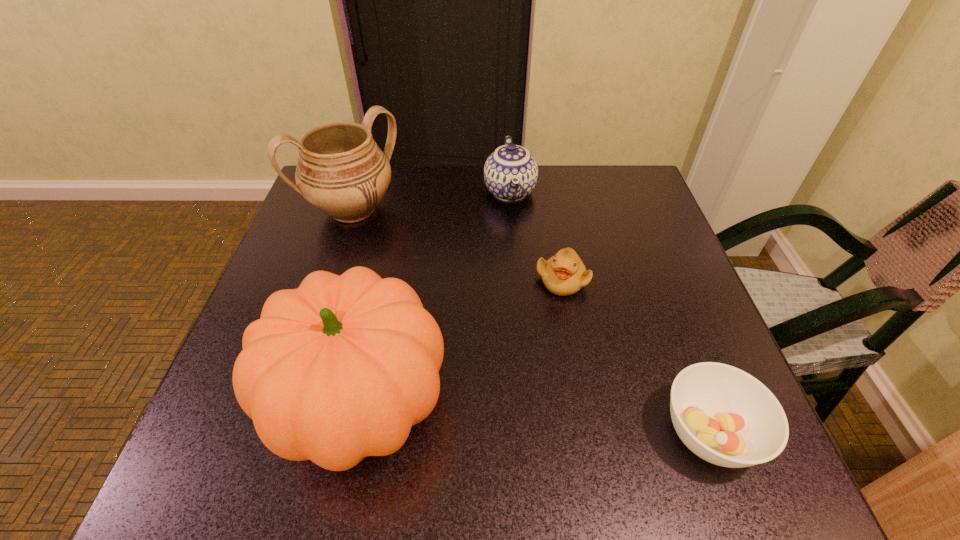
This screenshot has height=540, width=960. I want to click on free location located at the spout of the third shortest object, so click(x=517, y=246).

Where is `vacant region located at the spout of the third shortest object`? This screenshot has width=960, height=540. vacant region located at the spout of the third shortest object is located at coordinates [x=523, y=286].

The image size is (960, 540). What are the coordinates of `vacant area located 0.210m at the spout of the third shortest object` in the screenshot? It's located at (522, 280).

The width and height of the screenshot is (960, 540). Identify the location of free point located on the front-facing side of the urn. (444, 309).

The height and width of the screenshot is (540, 960). I want to click on vacant area situated 0.360m on the front-facing side of the urn, so click(x=462, y=328).

This screenshot has width=960, height=540. I want to click on vacant space situated 0.390m on the front-facing side of the urn, so click(x=470, y=338).

Identify the location of chinaware present at the far edge. The image size is (960, 540). (510, 173).

The height and width of the screenshot is (540, 960). Find the location of `urn located at the far edge`. urn located at the far edge is located at coordinates (341, 171).

Image resolution: width=960 pixels, height=540 pixels. In order to click on pumpkin that is at the near edge in this screenshot , I will do `click(341, 368)`.

I want to click on soup bowl that is at the near edge, so click(x=727, y=417).